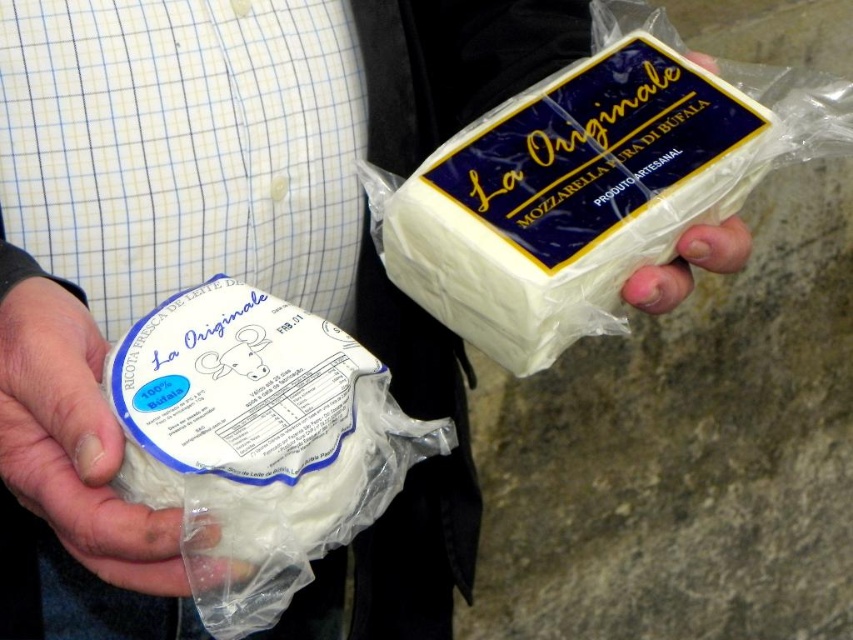
Does point (79, 480) come in front of point (641, 292)?

That is True.

Which of these two, white matte cheese at left or pale skin at center, stands taller?

With more height is white matte cheese at left.

Is point (148, 545) farther from viewer compared to point (746, 232)?

No, (148, 545) is closer to viewer.

At what (x,y) coordinates should I click in order to perform the action: click on white matte cheese at left. Please return your answer as a coordinate pair (x, y). Looking at the image, I should click on (74, 444).

What do you see at coordinates (569, 198) in the screenshot? Image resolution: width=853 pixels, height=640 pixels. I see `white creamy mozzarella at upper right` at bounding box center [569, 198].

Is white creamy mozzarella at upper right behind white matte cheese at left?

Yes, it is.

Is point (564, 189) positioned in front of point (83, 344)?

No, it is behind (83, 344).

Where is `white creamy mozzarella at upper right`? white creamy mozzarella at upper right is located at coordinates (569, 198).

Who is more distant from viewer, (555, 280) or (703, 244)?

The point (703, 244) is behind.

Based on the photo, between white creamy mozzarella at upper right and pale skin at center, which one has more height?

Standing taller between the two is white creamy mozzarella at upper right.

Measure the distance between point (654, 257) and camera.

Point (654, 257) and camera are 23.66 inches apart.

Locate an element on the screen. Image resolution: width=853 pixels, height=640 pixels. white creamy mozzarella at upper right is located at coordinates (569, 198).